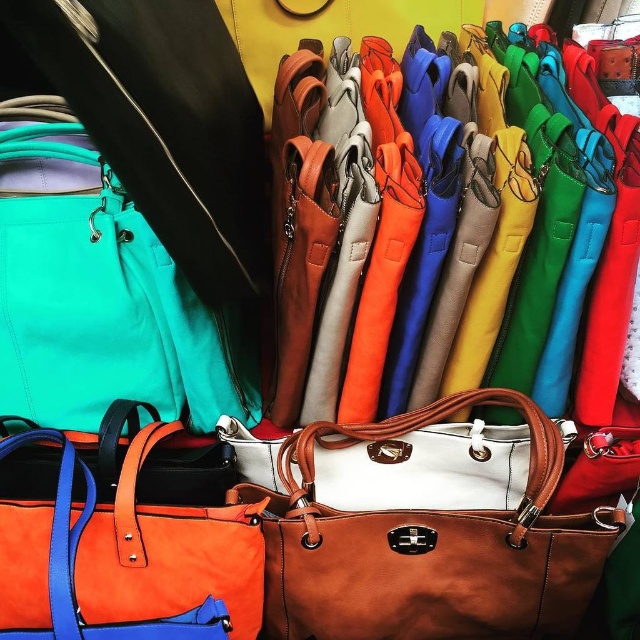
Which of these two, brown leather tote at center or orange leather tote at center, stands shorter?

With less height is orange leather tote at center.

Locate an element on the screen. The height and width of the screenshot is (640, 640). brown leather tote at center is located at coordinates (422, 534).

Is point (404, 627) less distant than point (172, 522)?

No.

You are a GUI agent. You are given a task and a screenshot of the screen. Output one action in this format:
    pyautogui.click(x=<x>, y=<y>)
    Task: Click on the brown leather tote at center
    This screenshot has height=640, width=640.
    Given the screenshot: What is the action you would take?
    pyautogui.click(x=422, y=534)